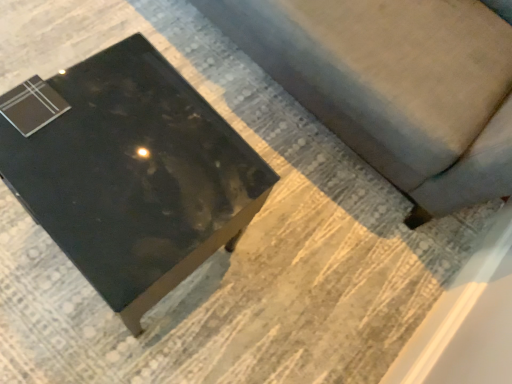
I want to click on blank space situated above glossy black table at lower left (from a real-world perspective), so click(120, 169).